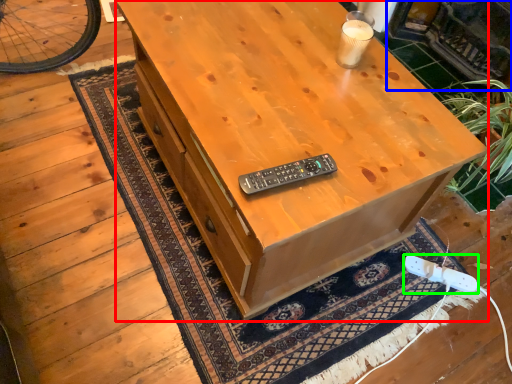
Question: Estimate the real-world distances between objects in this image. Which object is closer to desk (highlighted by a red box), fireplace (highlighted by a blue box) or game controller (highlighted by a green box)?

Choices:
 (A) fireplace
 (B) game controller

Answer: (B)